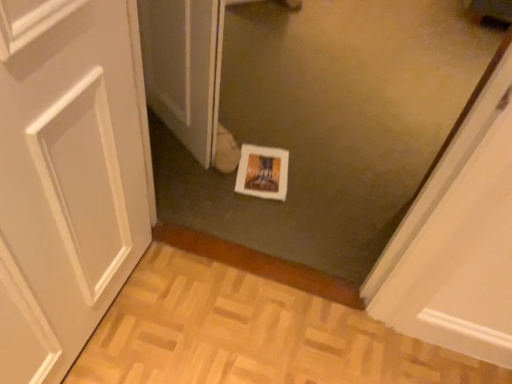
I want to click on free location in front of white glossy screen door at center, so click(x=185, y=173).